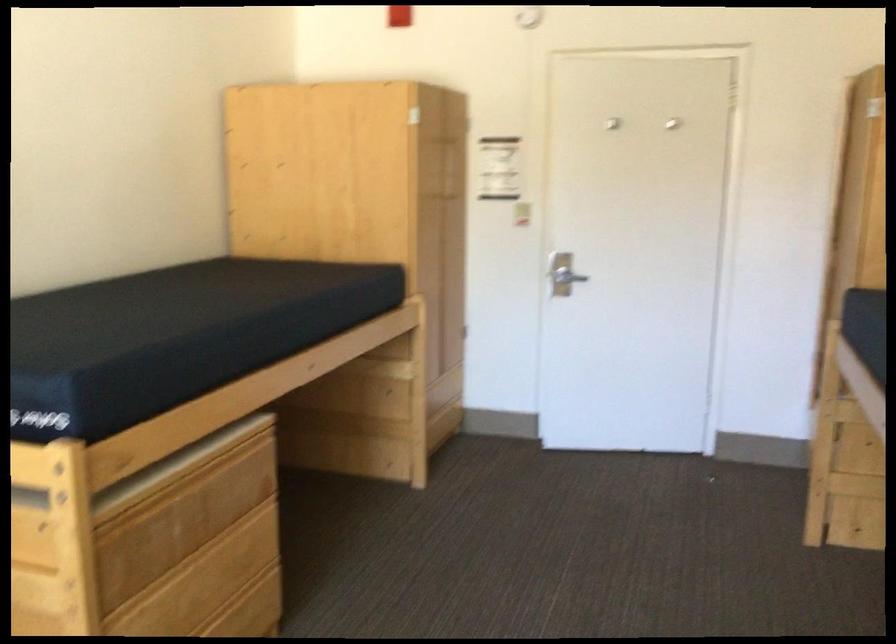
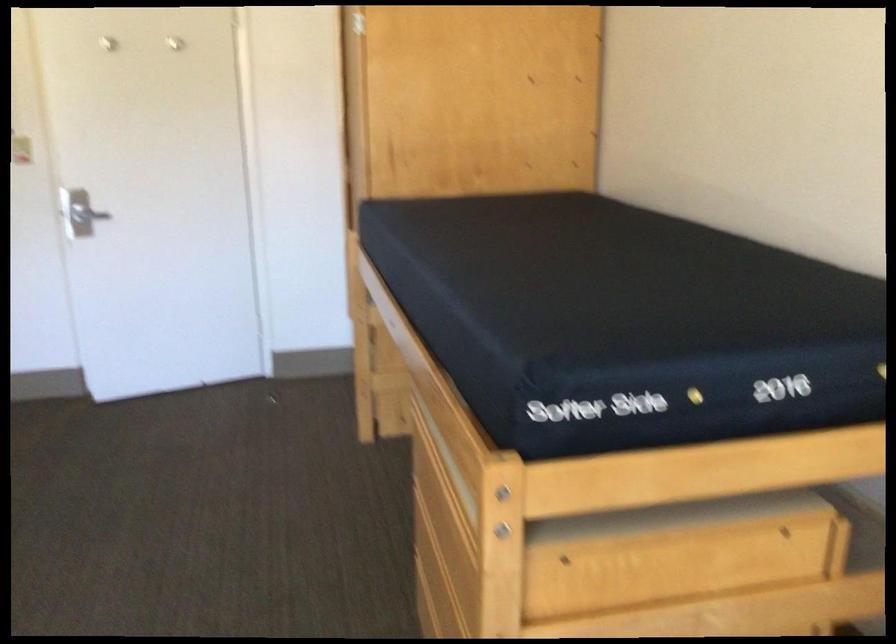
The point at (x=590, y=267) is marked in the first image. Where is the corresponding point in the second image?

(87, 214)